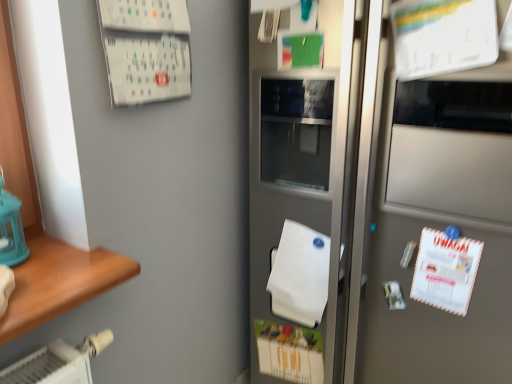
Question: In the image, is satin silver refrigerator at center positioned in front of or behind white matte wrapping paper at center?

Choices:
 (A) behind
 (B) front

Answer: (B)

Question: Considering the positions of satin silver refrigerator at center and white matte wrapping paper at center in the image, is satin silver refrigerator at center taller or shorter than white matte wrapping paper at center?

Choices:
 (A) tall
 (B) short

Answer: (A)

Question: Is satin silver refrigerator at center wider or thinner than white matte wrapping paper at center?

Choices:
 (A) wide
 (B) thin

Answer: (A)

Question: From a real-world perspective, is white matte wrapping paper at center positioned above or below satin silver refrigerator at center?

Choices:
 (A) above
 (B) below

Answer: (B)

Question: Is white matte wrapping paper at center wider or thinner than satin silver refrigerator at center?

Choices:
 (A) thin
 (B) wide

Answer: (A)

Question: Looking at the image, does white matte wrapping paper at center seem bigger or smaller compared to satin silver refrigerator at center?

Choices:
 (A) big
 (B) small

Answer: (B)

Question: Is white matte wrapping paper at center inside the boundaries of satin silver refrigerator at center, or outside?

Choices:
 (A) outside
 (B) inside

Answer: (B)